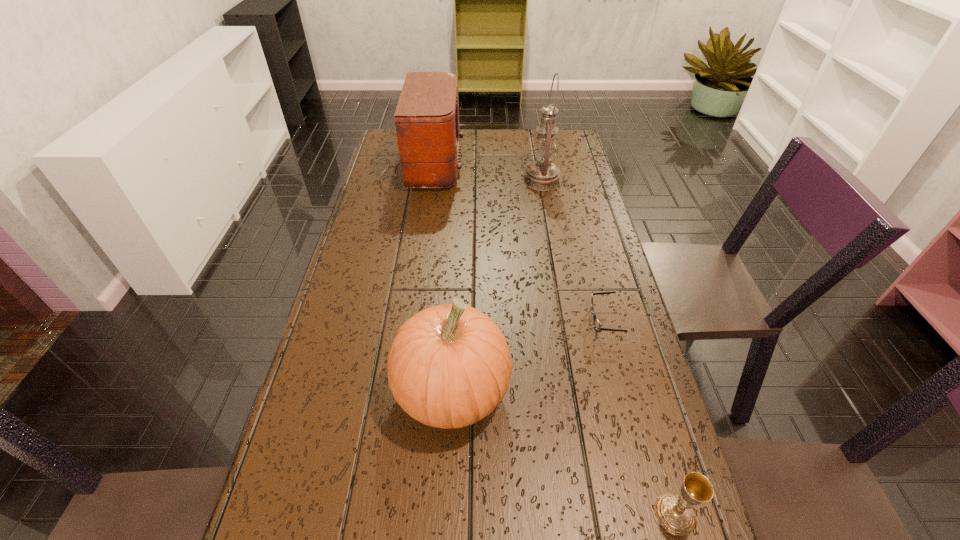
Identify the location of oil lamp. This screenshot has width=960, height=540. (542, 175).

Find the location of a particular element. This screenshot has width=960, height=540. radio receiver is located at coordinates (426, 119).

I want to click on the second nearest object, so click(x=449, y=366).

Where is `the second shortest object`? the second shortest object is located at coordinates (675, 514).

Where is `the nearest object`? The width and height of the screenshot is (960, 540). the nearest object is located at coordinates (675, 514).

Find the location of a particular element. the shortest object is located at coordinates (597, 325).

This screenshot has width=960, height=540. I want to click on spectacles, so click(597, 325).

The height and width of the screenshot is (540, 960). I want to click on free space located on the back of the oil lamp, so click(x=535, y=143).

You are a GUI agent. You are given a task and a screenshot of the screen. Output one action in this format:
    pyautogui.click(x=<x>, y=<y>)
    Task: Click on the vacant point located 0.240m on the front panel of the radio receiver
    Image resolution: width=960 pixels, height=540 pixels.
    Given the screenshot: What is the action you would take?
    pyautogui.click(x=530, y=166)

Locate an element on the screen. vacant space located on the stem of the pumpkin is located at coordinates (552, 391).